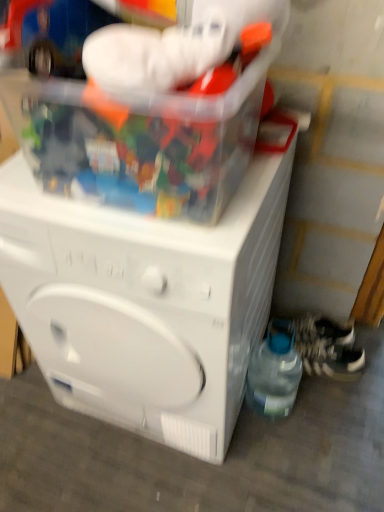
Question: Considering the positions of white plastic washing machine at center and white textured shoe at lower right, which ranks as the 1th shoe in top-to-bottom order, in the image, is white plastic washing machine at center wider or thinner than white textured shoe at lower right, which ranks as the 1th shoe in top-to-bottom order,?

Choices:
 (A) thin
 (B) wide

Answer: (B)

Question: Is white plastic washing machine at center bigger or smaller than white textured shoe at lower right, marked as the 2th shoe in a bottom-to-top arrangement?

Choices:
 (A) big
 (B) small

Answer: (A)

Question: Which object is positioned farthest from the white textured shoe at lower right, which appears as the second shoe when viewed from the top?

Choices:
 (A) white textured shoe at lower right, which ranks as the 1th shoe in top-to-bottom order
 (B) white plastic washing machine at center
 (C) transparent plastic bottle at lower right
 (D) translucent plastic container at upper center

Answer: (D)

Question: Which of these objects is positioned closest to the transparent plastic bottle at lower right?

Choices:
 (A) white textured shoe at lower right, which ranks as the 1th shoe in top-to-bottom order
 (B) white plastic washing machine at center
 (C) white textured shoe at lower right, which appears as the second shoe when viewed from the top
 (D) translucent plastic container at upper center

Answer: (C)